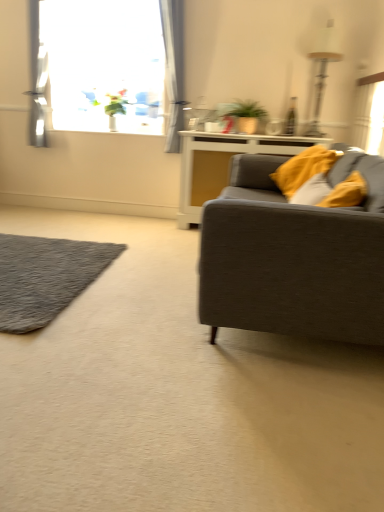
Question: From a real-world perspective, is matte white cabinet at center on gray shaggy rug at lower left?

Choices:
 (A) no
 (B) yes

Answer: (B)

Question: Is gray shaggy rug at lower left surrounded by matte white cabinet at center?

Choices:
 (A) yes
 (B) no

Answer: (B)

Question: Is matte white cabinet at center smaller than gray shaggy rug at lower left?

Choices:
 (A) no
 (B) yes

Answer: (A)

Question: Is matte white cabinet at center bigger than gray shaggy rug at lower left?

Choices:
 (A) yes
 (B) no

Answer: (A)

Question: Can you confirm if matte white cabinet at center is shorter than gray shaggy rug at lower left?

Choices:
 (A) no
 (B) yes

Answer: (A)

Question: Is matte white cabinet at center oriented away from gray shaggy rug at lower left?

Choices:
 (A) yes
 (B) no

Answer: (B)

Question: Does soft yellow pillow at right lie in front of light gray sheer curtain at upper left?

Choices:
 (A) yes
 (B) no

Answer: (A)

Question: Can you confirm if soft yellow pillow at right is positioned to the right of light gray sheer curtain at upper left?

Choices:
 (A) no
 (B) yes

Answer: (B)

Question: Is light gray sheer curtain at upper left a part of soft yellow pillow at right?

Choices:
 (A) no
 (B) yes

Answer: (A)

Question: Considering the relative positions of soft yellow pillow at right and light gray sheer curtain at upper left in the image provided, is soft yellow pillow at right to the left of light gray sheer curtain at upper left from the viewer's perspective?

Choices:
 (A) yes
 (B) no

Answer: (B)

Question: Is soft yellow pillow at right shorter than light gray sheer curtain at upper left?

Choices:
 (A) no
 (B) yes

Answer: (B)

Question: Is soft yellow pillow at right positioned beyond the bounds of light gray sheer curtain at upper left?

Choices:
 (A) yes
 (B) no

Answer: (A)

Question: Can you confirm if transparent glass window at upper left is bigger than light gray sheer curtain at upper left?

Choices:
 (A) yes
 (B) no

Answer: (A)